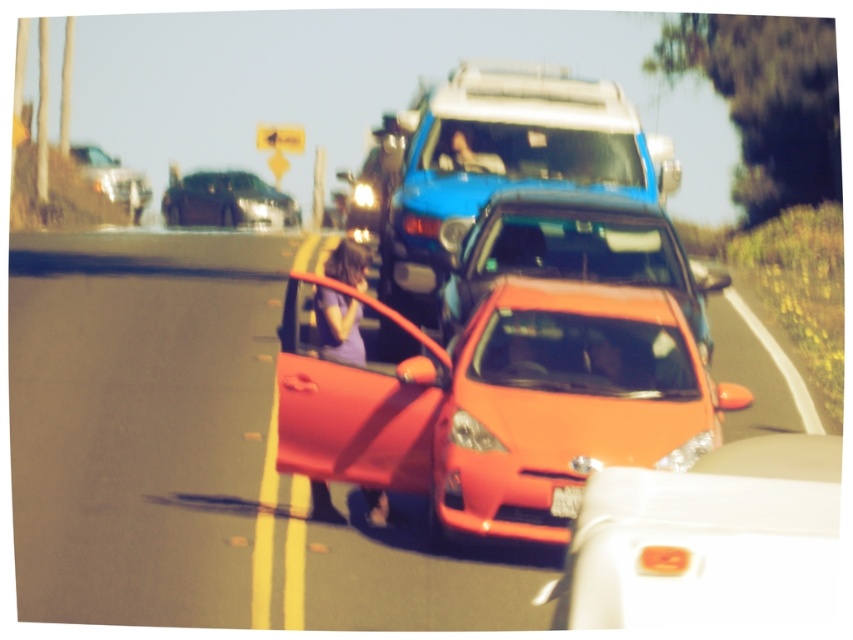
Question: Which object appears farthest from the camera in this image?

Choices:
 (A) blue matte minivan at center
 (B) metallic silver car at center
 (C) shiny black sedan at upper left

Answer: (C)

Question: Does shiny orange car at center appear on the right side of orange matte car at center?

Choices:
 (A) no
 (B) yes

Answer: (A)

Question: Observing the image, what is the correct spatial positioning of blue matte minivan at center in reference to shiny black sedan at upper left?

Choices:
 (A) above
 (B) below

Answer: (A)

Question: Can you confirm if metallic silver car at center is positioned above shiny orange sedan at center?

Choices:
 (A) yes
 (B) no

Answer: (B)

Question: Which point is closer to the camera?

Choices:
 (A) metallic silver car at center
 (B) orange matte car at center
 (C) blue matte minivan at center
 (D) shiny orange sedan at center

Answer: (A)

Question: Which of the following is the closest to the observer?

Choices:
 (A) matte silver suv at upper left
 (B) shiny orange car at center
 (C) white plastic license plate at center

Answer: (B)